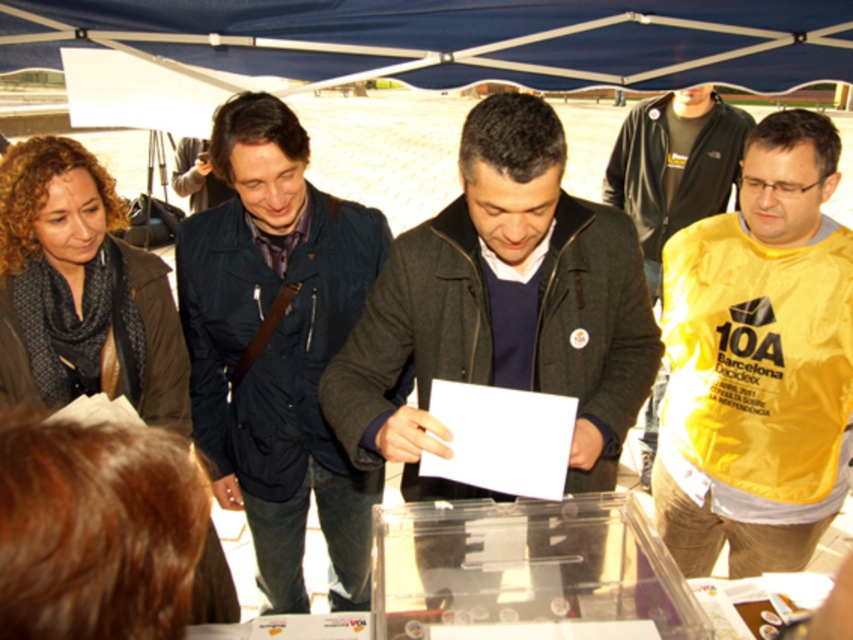
You are a photographer at the event and need to capture a photo of both the dark blue jacket at center and the yellow fabric shirt at right. Based on their heights, which object should be positioned closer to the camera to ensure both are fully visible in the frame?

The dark blue jacket at center is taller than the yellow fabric shirt at right, so positioning the dark blue jacket at center closer to the camera will help balance their sizes in the photo, ensuring both are fully visible.